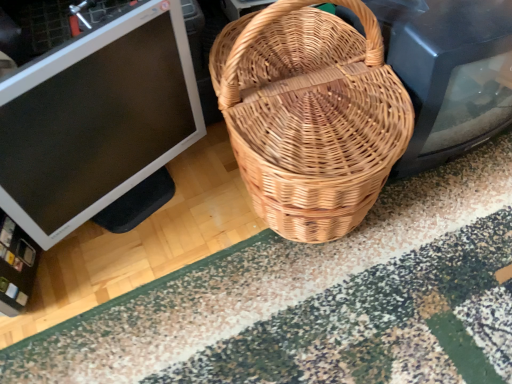
This screenshot has width=512, height=384. In order to click on empty space that is ontop of patterned carpet at center in this screenshot , I will do `click(359, 285)`.